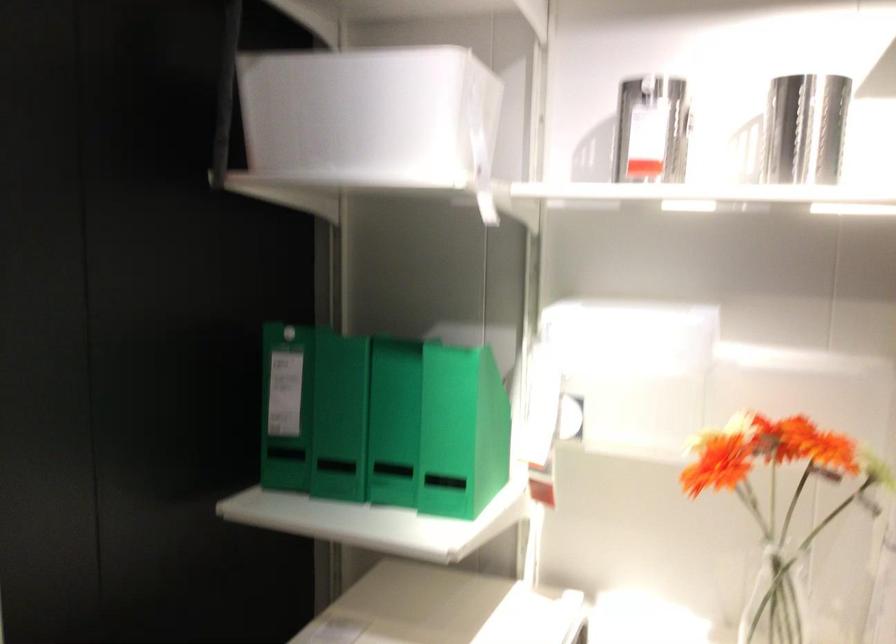
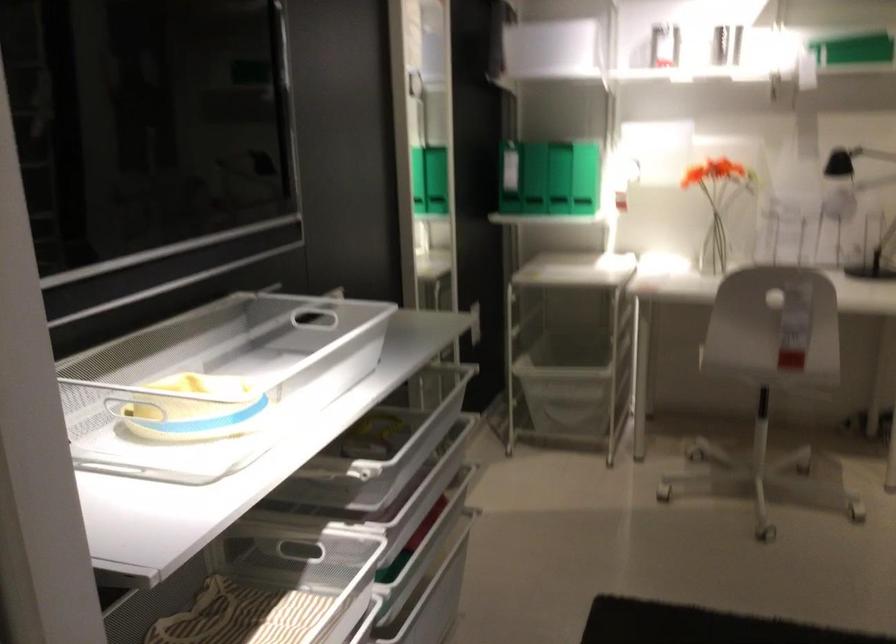
The point at (383, 437) is marked in the first image. Where is the corresponding point in the second image?

(558, 178)